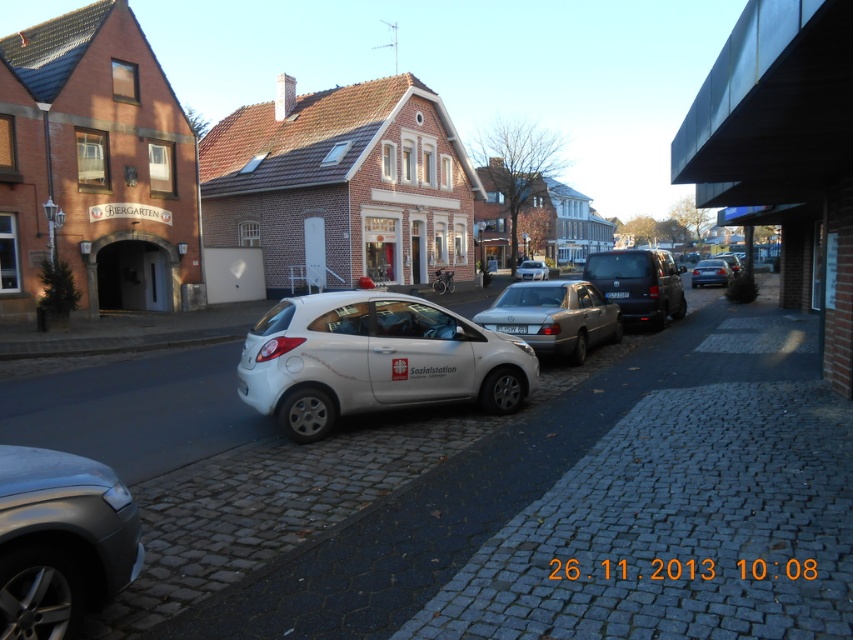
Question: Is metallic silver sedan at center-right thinner than black plastic license plate at center?

Choices:
 (A) yes
 (B) no

Answer: (B)

Question: Does silver metallic sedan at center appear under black plastic license plate at center?

Choices:
 (A) yes
 (B) no

Answer: (A)

Question: Which point appears farthest from the camera in this image?

Choices:
 (A) (619, 296)
 (B) (97, 604)
 (C) (521, 332)
 (D) (329, 406)

Answer: (A)

Question: Which of these objects is positioned farthest from the white matte car at center?

Choices:
 (A) shiny black van at center
 (B) silver metallic sedan at center

Answer: (A)

Question: Does white matte car at center have a greater width compared to shiny black van at center?

Choices:
 (A) no
 (B) yes

Answer: (B)

Question: Which object is positioned farthest from the silver metallic car at lower left?

Choices:
 (A) black plastic license plate at center
 (B) silver metallic sedan at center
 (C) white matte car at center
 (D) metallic silver sedan at center-right

Answer: (D)